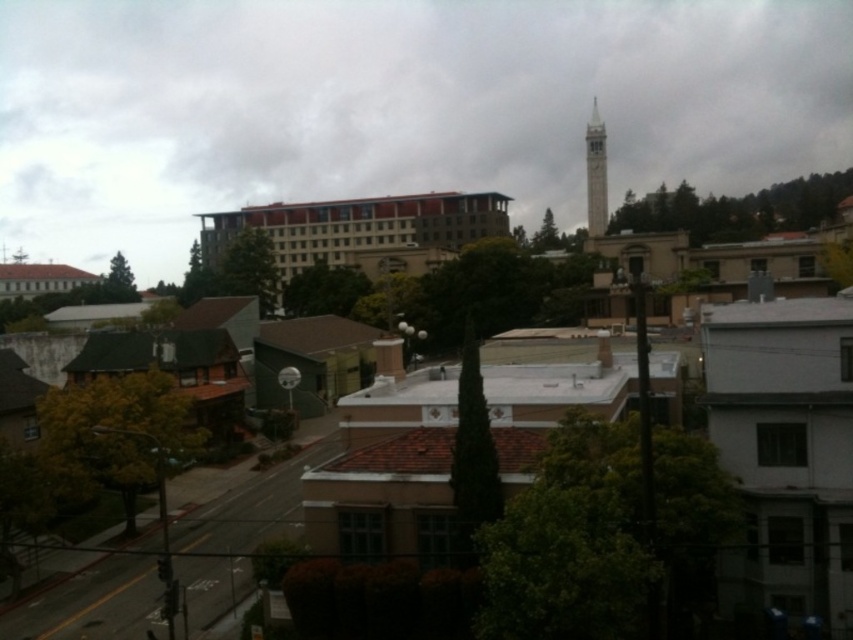
Which is in front, point (595, 125) or point (595, 170)?

Point (595, 170) is more forward.

Between white stone tower at center and smooth white bell tower at upper center, which one has less height?

Standing shorter between the two is smooth white bell tower at upper center.

Find the location of a particular element. This screenshot has width=853, height=640. white stone tower at center is located at coordinates (595, 177).